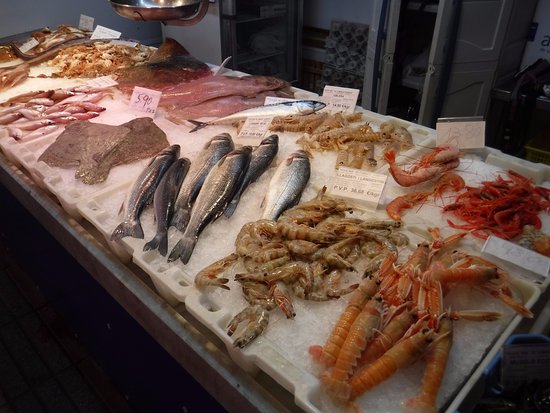
I want to click on shelf, so click(x=282, y=7), click(x=250, y=18), click(x=254, y=45), click(x=260, y=62).